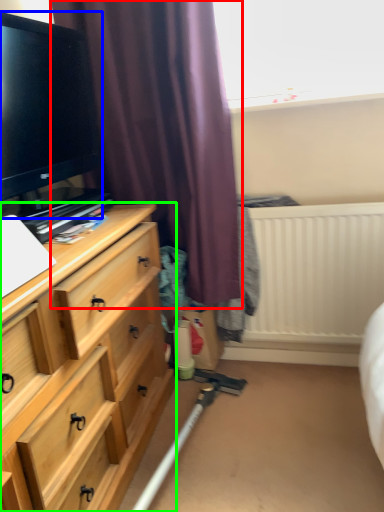
Question: Based on their relative distances, which object is nearer to curtain (highlighted by a red box)? Choose from television (highlighted by a blue box) and chest of drawers (highlighted by a green box).

Choices:
 (A) television
 (B) chest of drawers

Answer: (A)